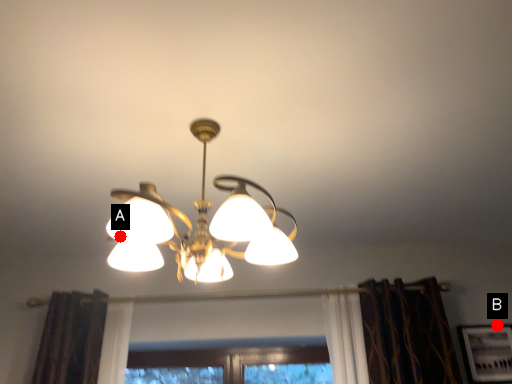
Question: Two points are circled on the image, labeled by A and B beside each circle. Among these points, which one is farthest from the camera?

Choices:
 (A) A is further
 (B) B is further

Answer: (B)